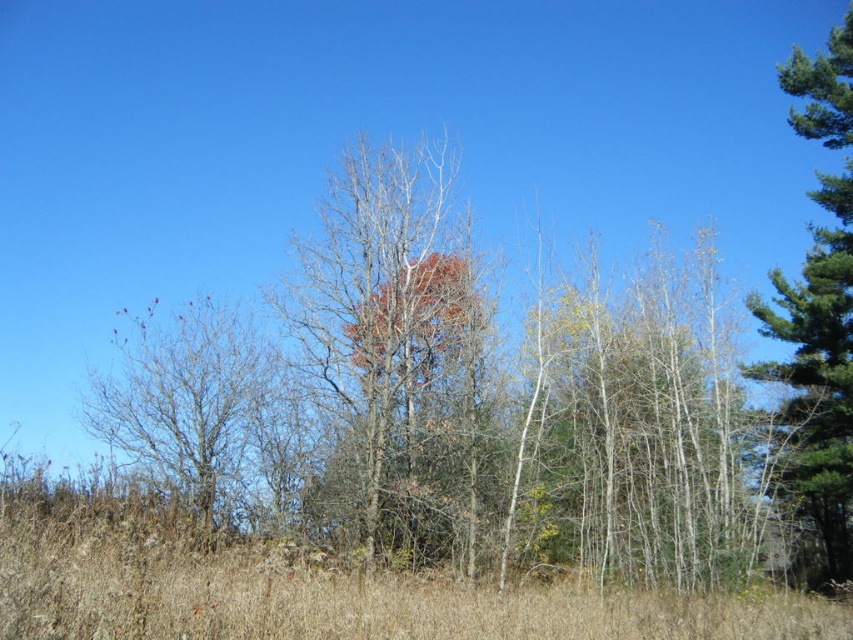
Question: Is bare branches at center below brown dry grass at lower center?

Choices:
 (A) no
 (B) yes

Answer: (A)

Question: Estimate the real-world distances between objects in this image. Which object is farther from the bare branches at left?

Choices:
 (A) bare branches at center
 (B) brown dry grass at lower center
 (C) reddish-brown bark tree at center

Answer: (B)

Question: Does brown dry grass at lower center have a smaller size compared to green textured pine tree at right?

Choices:
 (A) yes
 (B) no

Answer: (A)

Question: Which object is closer to the camera taking this photo?

Choices:
 (A) bare branches at center
 (B) green textured pine tree at right
 (C) bare branches at left
 (D) brown dry grass at lower center

Answer: (D)

Question: Considering the real-world distances, which object is closest to the bare branches at left?

Choices:
 (A) bare branches at center
 (B) green textured pine tree at right
 (C) brown dry grass at lower center

Answer: (A)

Question: Where is green textured pine tree at right located in relation to bare branches at left in the image?

Choices:
 (A) right
 (B) left

Answer: (A)